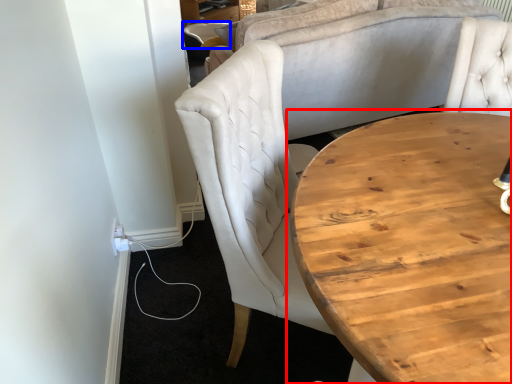
Question: Which point is closer to the camera, coffee table (highlighted by a red box) or chair (highlighted by a blue box)?

Choices:
 (A) coffee table
 (B) chair

Answer: (A)